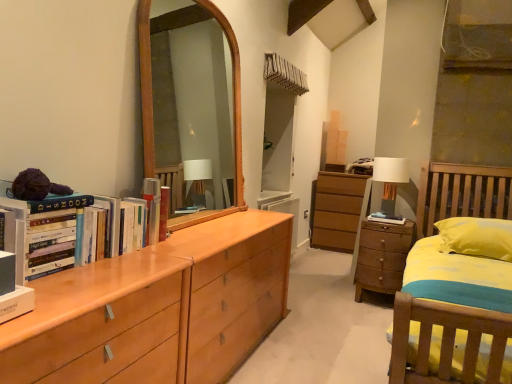
Question: Is white fabric lampshade at right directly adjacent to wooden chest of drawers at right?

Choices:
 (A) yes
 (B) no

Answer: (B)

Question: From the image's perspective, is white fabric lampshade at right above wooden chest of drawers at right?

Choices:
 (A) yes
 (B) no

Answer: (A)

Question: From a real-world perspective, is white fabric lampshade at right over wooden chest of drawers at right?

Choices:
 (A) yes
 (B) no

Answer: (A)

Question: Does white fabric lampshade at right come behind wooden chest of drawers at right?

Choices:
 (A) no
 (B) yes

Answer: (B)

Question: Is white fabric lampshade at right oriented away from wooden chest of drawers at right?

Choices:
 (A) no
 (B) yes

Answer: (A)

Question: Is white fabric lampshade at right thinner than wooden chest of drawers at right?

Choices:
 (A) no
 (B) yes

Answer: (B)

Question: Is wooden chest of drawers at right wider than white fabric lampshade at right?

Choices:
 (A) no
 (B) yes

Answer: (B)

Question: Does wooden chest of drawers at right have a larger size compared to white fabric lampshade at right?

Choices:
 (A) no
 (B) yes

Answer: (B)

Question: Is wooden chest of drawers at right not inside white fabric lampshade at right?

Choices:
 (A) no
 (B) yes

Answer: (B)

Question: Is wooden chest of drawers at right oriented away from white fabric lampshade at right?

Choices:
 (A) yes
 (B) no

Answer: (B)

Question: Is wooden chest of drawers at right facing towards white fabric lampshade at right?

Choices:
 (A) yes
 (B) no

Answer: (B)

Question: Is wooden chest of drawers at right shorter than white fabric lampshade at right?

Choices:
 (A) no
 (B) yes

Answer: (A)

Question: Is white fabric lampshade at right wider or thinner than wooden chest of drawers at right?

Choices:
 (A) thin
 (B) wide

Answer: (A)